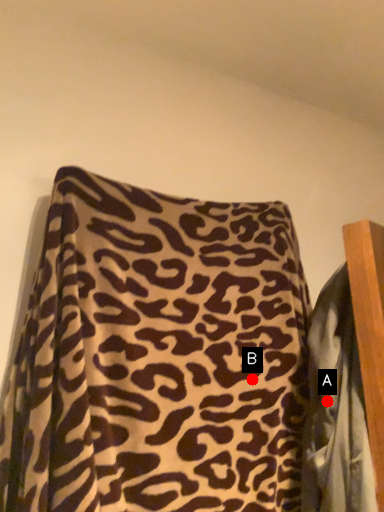
Question: Two points are circled on the image, labeled by A and B beside each circle. Which point is closer to the camera?

Choices:
 (A) A is closer
 (B) B is closer

Answer: (A)